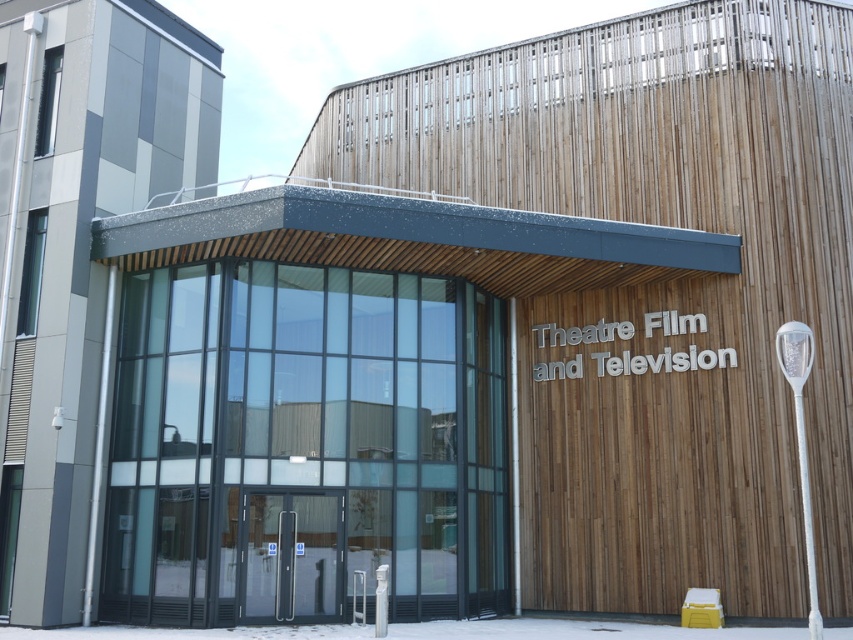
Question: Among these points, which one is farthest from the camera?

Choices:
 (A) (270, 496)
 (B) (473, 632)

Answer: (A)

Question: Can you confirm if transparent glass doors at center is positioned below white powdery snow at lower center?

Choices:
 (A) no
 (B) yes

Answer: (A)

Question: From the image, what is the correct spatial relationship of transparent glass doors at center in relation to white powdery snow at lower center?

Choices:
 (A) left
 (B) right

Answer: (A)

Question: Which point is closer to the camera?

Choices:
 (A) white powdery snow at lower center
 (B) transparent glass doors at center

Answer: (A)

Question: From the image, what is the correct spatial relationship of transparent glass doors at center in relation to white powdery snow at lower center?

Choices:
 (A) above
 (B) below

Answer: (A)